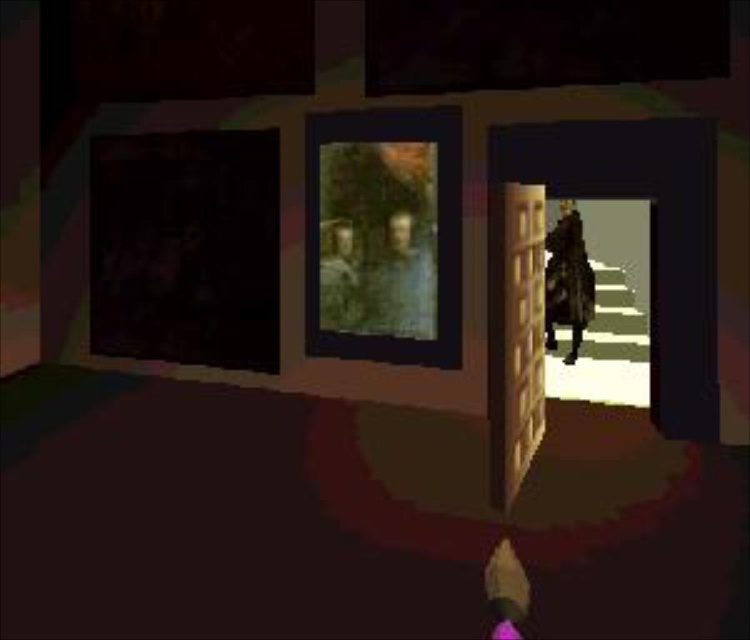
Is olive green fabric portrait at center positioned before leather jacket at center?

Yes.

The height and width of the screenshot is (640, 750). I want to click on olive green fabric portrait at center, so click(x=404, y=282).

Looking at this image, is leather jacket at center shorter than green camouflage jacket at center?

No.

Does leather jacket at center appear on the right side of green camouflage jacket at center?

Indeed, leather jacket at center is positioned on the right side of green camouflage jacket at center.

Who is more forward, (586, 275) or (345, 260)?

Point (345, 260) is more forward.

I want to click on leather jacket at center, so click(567, 282).

Is olive green fabric portrait at center below green camouflage jacket at center?

No, olive green fabric portrait at center is not below green camouflage jacket at center.

Who is taller, olive green fabric portrait at center or green camouflage jacket at center?

olive green fabric portrait at center

Image resolution: width=750 pixels, height=640 pixels. Describe the element at coordinates (404, 282) in the screenshot. I see `olive green fabric portrait at center` at that location.

The height and width of the screenshot is (640, 750). Identify the location of olive green fabric portrait at center. (404, 282).